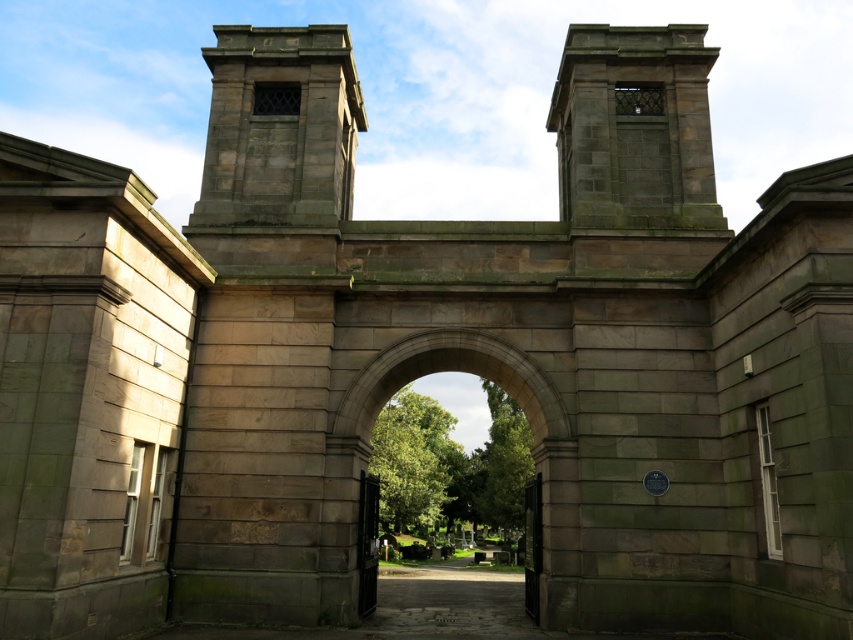
You are standing in front of the grand stone archway and want to walk through the gates. Which gate, the polished dark wood gate at center or the polished dark green gate at center, is closer to you?

The polished dark wood gate at center is closer to you because it is further to the viewer than the polished dark green gate at center.

Looking at this image, you are standing in front of the entrance and want to walk through the gate. Which direction should you move relative to the stone archway at center and the polished dark wood gate at center?

The stone archway at center is positioned on the right side of the polished dark wood gate at center, so you should move to the left side of the stone archway at center to reach the gate.